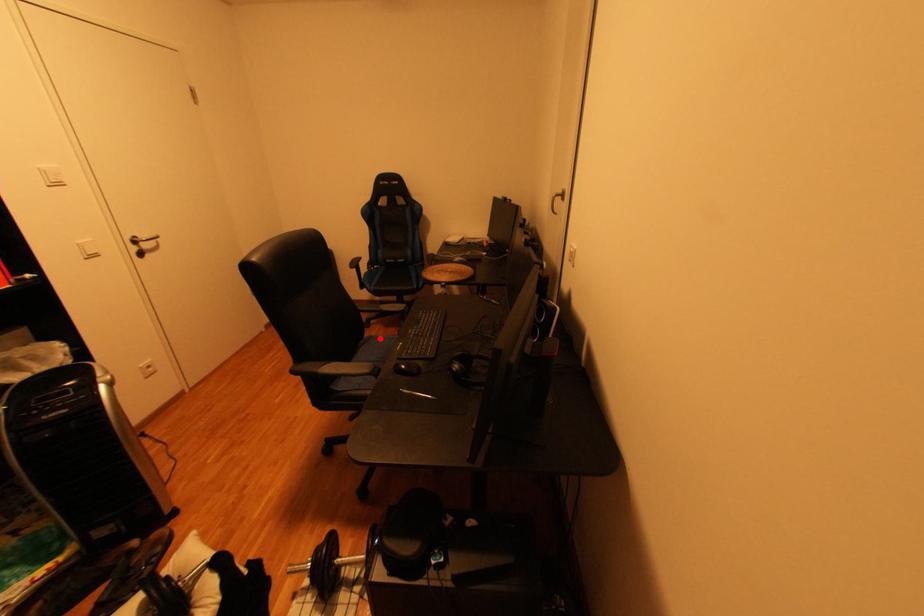
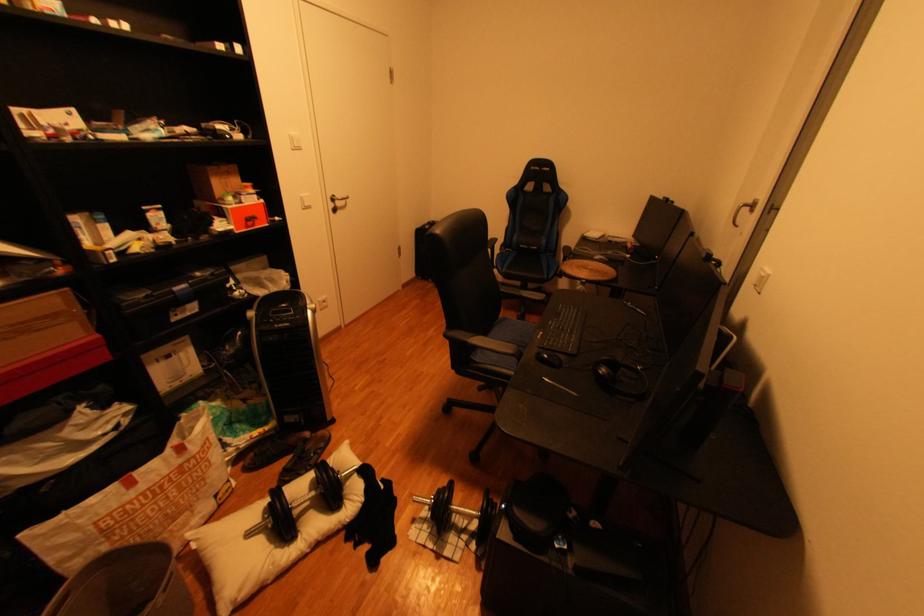
In the second image, find the point that corresponds to the highlighted location in the first image.

(515, 320)